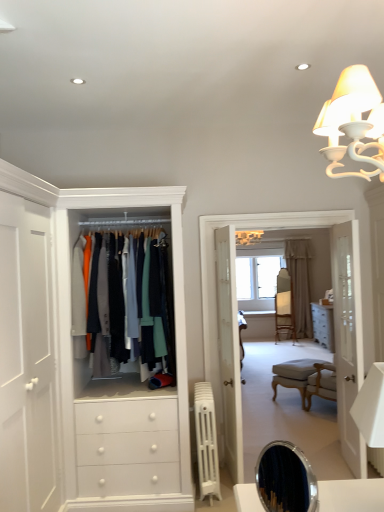
Question: Is beige fabric curtain at center thinner than wooden floor at center?

Choices:
 (A) no
 (B) yes

Answer: (B)

Question: Can you confirm if beige fabric curtain at center is positioned to the left of wooden floor at center?

Choices:
 (A) yes
 (B) no

Answer: (B)

Question: From a real-world perspective, is beige fabric curtain at center located beneath wooden floor at center?

Choices:
 (A) no
 (B) yes

Answer: (B)

Question: Is wooden floor at center at the back of beige fabric curtain at center?

Choices:
 (A) no
 (B) yes

Answer: (A)

Question: From the image's perspective, is beige fabric curtain at center below wooden floor at center?

Choices:
 (A) no
 (B) yes

Answer: (B)

Question: Is the position of beige fabric curtain at center less distant than that of wooden floor at center?

Choices:
 (A) yes
 (B) no

Answer: (B)

Question: Can you confirm if wooden floor at center is thinner than white glass door at right?

Choices:
 (A) no
 (B) yes

Answer: (A)

Question: Considering the relative sizes of wooden floor at center and white glass door at right in the image provided, is wooden floor at center bigger than white glass door at right?

Choices:
 (A) yes
 (B) no

Answer: (A)

Question: Considering the relative positions of wooden floor at center and white glass door at right in the image provided, is wooden floor at center in front of white glass door at right?

Choices:
 (A) yes
 (B) no

Answer: (B)

Question: Does wooden floor at center have a greater width compared to white glass door at right?

Choices:
 (A) yes
 (B) no

Answer: (A)

Question: From a real-world perspective, is wooden floor at center positioned under white glass door at right based on gravity?

Choices:
 (A) yes
 (B) no

Answer: (B)

Question: Could you tell me if wooden floor at center is facing white glass door at right?

Choices:
 (A) no
 (B) yes

Answer: (B)

Question: Can you confirm if beige fabric curtain at center is taller than wooden armchair at center?

Choices:
 (A) yes
 (B) no

Answer: (A)